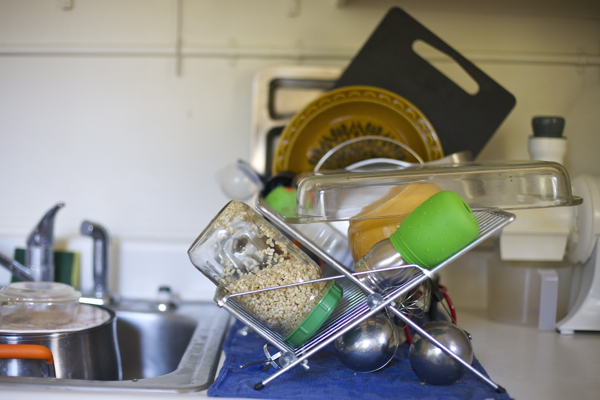
Find the location of a particular element. sink is located at coordinates (165, 332).